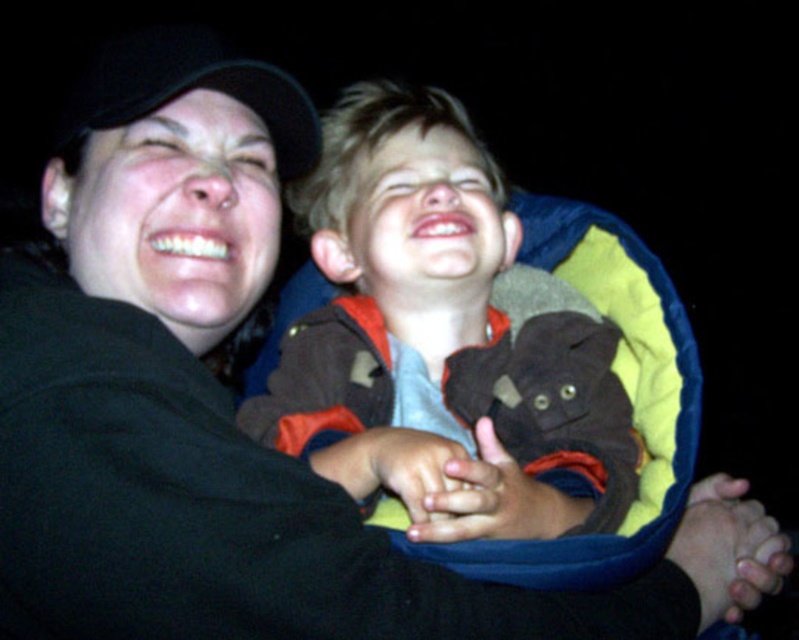
You are trying to place a new decorative item between the brown fuzzy stuffed animal at center and the black fabric baseball cap at upper left. Based on their positions, which side should the new item be placed on to ensure it is between them?

The new decorative item should be placed to the left of the brown fuzzy stuffed animal at center and to the right of the black fabric baseball cap at upper left since the brown fuzzy stuffed animal at center is to the right of the black fabric baseball cap at upper left.

You are designing a display case for a toy store that needs to accommodate both the brown fuzzy stuffed animal at center and the black fabric baseball cap at upper left. The case has two shelves with the lower shelf being 10 cm tall and the upper shelf 15 cm tall. Which shelf should each item be placed on to ensure they fit properly?

The brown fuzzy stuffed animal at center is taller than the black fabric baseball cap at upper left. Therefore, the brown fuzzy stuffed animal at center should be placed on the taller upper shelf which is 15 cm tall, while the black fabric baseball cap at upper left can fit on the lower 10 cm shelf.